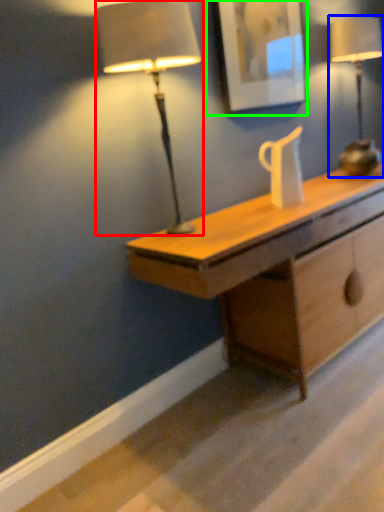
Question: Which object is positioned farthest from lamp (highlighted by a red box)? Select from lamp (highlighted by a blue box) and picture frame (highlighted by a green box).

Choices:
 (A) lamp
 (B) picture frame

Answer: (A)